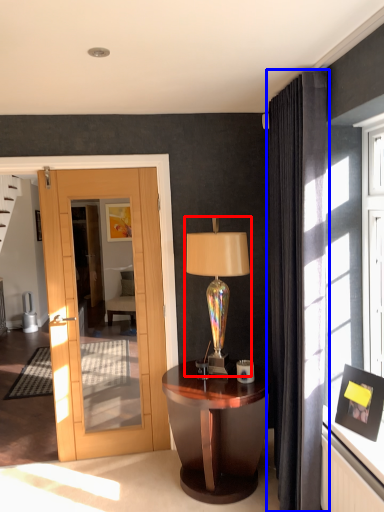
Question: Which point is further to the camera, table lamp (highlighted by a red box) or curtain (highlighted by a blue box)?

Choices:
 (A) table lamp
 (B) curtain

Answer: (A)